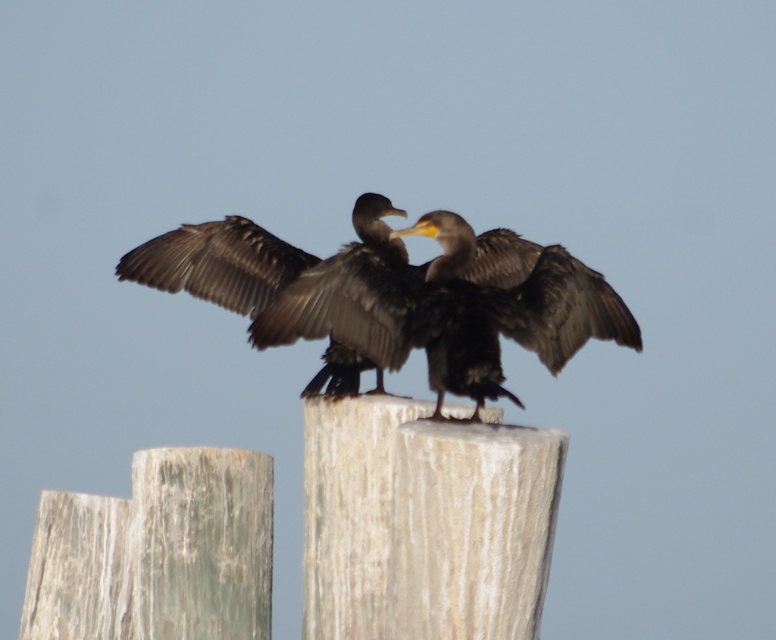
Who is higher up, dark brown feathers at center or brown feathered bird at center?

dark brown feathers at center

Can you confirm if dark brown feathers at center is positioned to the left of brown feathered bird at center?

In fact, dark brown feathers at center is to the right of brown feathered bird at center.

Locate an element on the screen. This screenshot has width=776, height=640. dark brown feathers at center is located at coordinates (504, 314).

The image size is (776, 640). What are the coordinates of `dark brown feathers at center` in the screenshot? It's located at (504, 314).

Is the position of white textured post at center less distant than that of brown feathered bird at center?

Yes, it is.

Does white textured post at center appear on the right side of brown feathered bird at center?

Correct, you'll find white textured post at center to the right of brown feathered bird at center.

You are a GUI agent. You are given a task and a screenshot of the screen. Output one action in this format:
    pyautogui.click(x=<x>, y=<y>)
    Task: Click on the white textured post at center
    Image resolution: width=776 pixels, height=640 pixels.
    Given the screenshot: What is the action you would take?
    pyautogui.click(x=423, y=524)

Who is positioned more to the right, white textured post at center or dark brown feathers at center?

Positioned to the right is dark brown feathers at center.

Does white textured post at center appear on the left side of dark brown feathers at center?

Correct, you'll find white textured post at center to the left of dark brown feathers at center.

Does point (390, 529) come farther from viewer compared to point (461, 308)?

That is True.

Identify the location of white textured post at center. Image resolution: width=776 pixels, height=640 pixels. (423, 524).